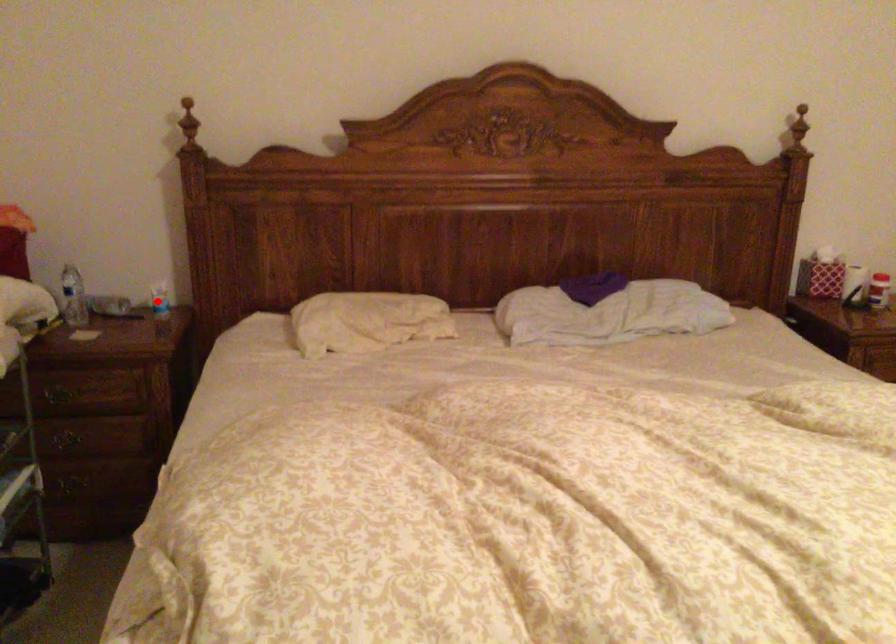
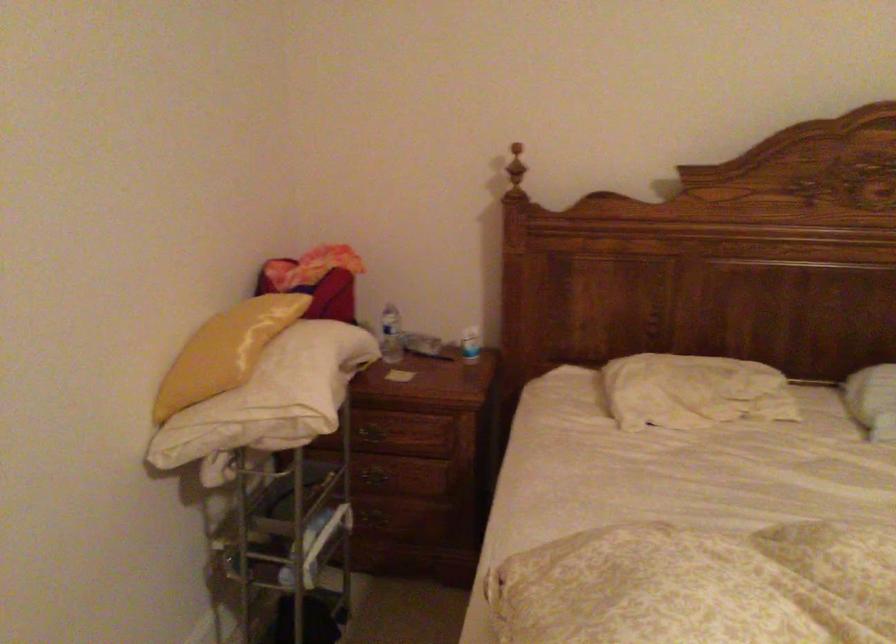
In the second image, find the point that corresponds to the highlighted location in the first image.

(470, 344)